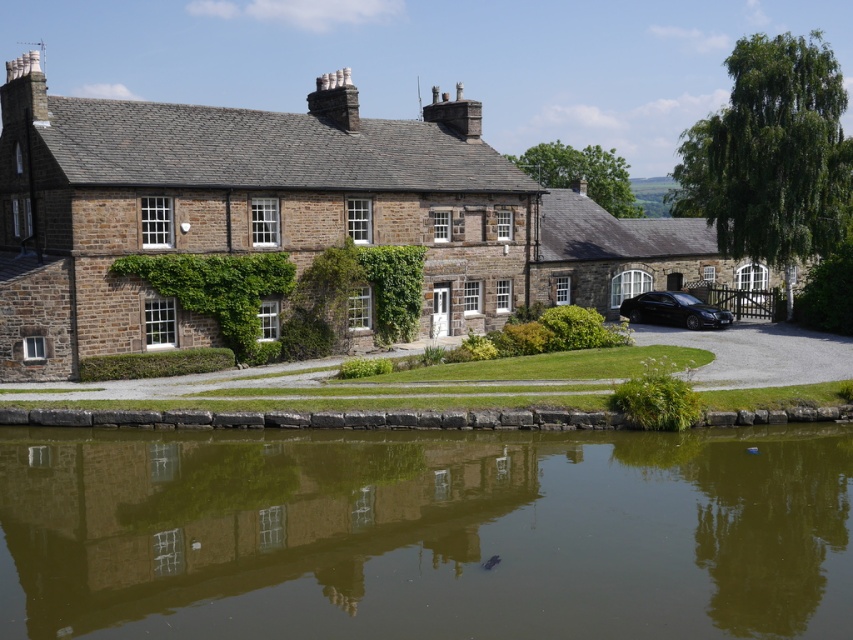
Question: Does green reflective water at lower center appear on the right side of matte stone cottage at right?

Choices:
 (A) no
 (B) yes

Answer: (A)

Question: Can you confirm if matte stone cottage at right is smaller than black glossy sedan at lower right?

Choices:
 (A) yes
 (B) no

Answer: (B)

Question: Which point is closer to the camera taking this photo?

Choices:
 (A) (273, 552)
 (B) (637, 310)

Answer: (A)

Question: Among these objects, which one is farthest from the camera?

Choices:
 (A) green reflective water at lower center
 (B) black glossy sedan at lower right
 (C) matte stone cottage at right

Answer: (B)

Question: Considering the relative positions of green reflective water at lower center and black glossy sedan at lower right in the image provided, where is green reflective water at lower center located with respect to black glossy sedan at lower right?

Choices:
 (A) above
 (B) below

Answer: (B)

Question: Which point is farther to the camera?

Choices:
 (A) black glossy sedan at lower right
 (B) matte stone cottage at right

Answer: (A)